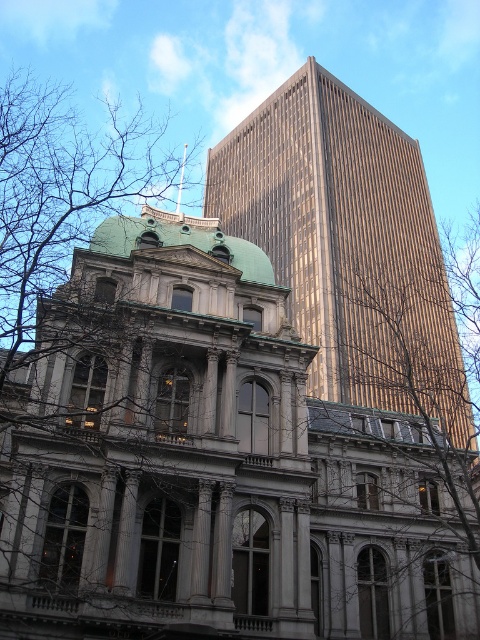
Which is in front, point (349, 160) or point (2, 326)?

Point (2, 326) is more forward.

Which is behind, point (372, 179) or point (28, 280)?

Positioned behind is point (372, 179).

Where is `gold reflective glass tower at upper center`? The width and height of the screenshot is (480, 640). gold reflective glass tower at upper center is located at coordinates (348, 244).